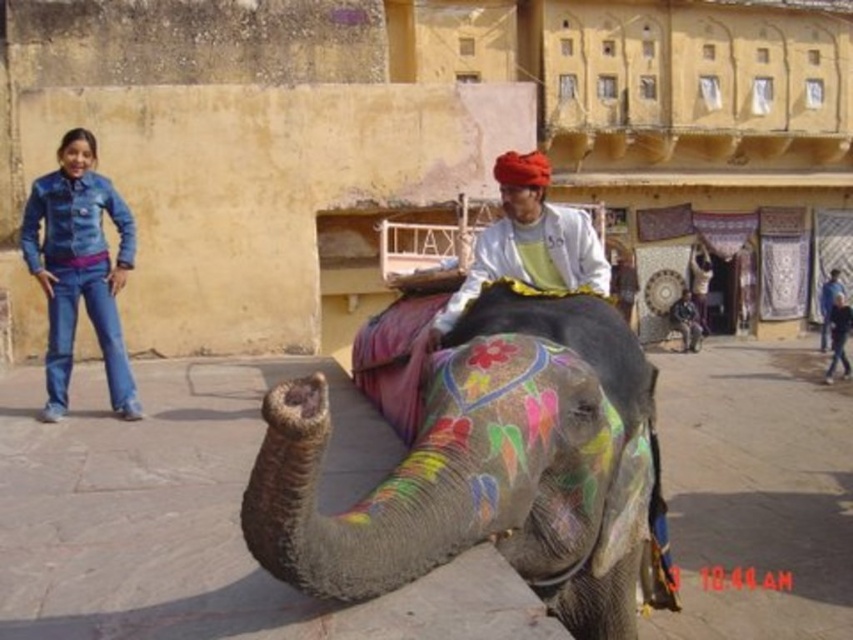
Question: Does painted fabric elephant at center appear over denim jeans at left?

Choices:
 (A) no
 (B) yes

Answer: (A)

Question: Which point appears closest to the camera in this image?

Choices:
 (A) (74, 246)
 (B) (502, 529)
 (C) (552, 275)

Answer: (B)

Question: Is denim jeans at left further to the viewer compared to matte white shirt at center?

Choices:
 (A) no
 (B) yes

Answer: (B)

Question: Estimate the real-world distances between objects in this image. Which object is closer to the painted fabric elephant at center?

Choices:
 (A) denim jeans at left
 (B) matte white shirt at center

Answer: (B)

Question: Which object appears farthest from the camera in this image?

Choices:
 (A) painted fabric elephant at center
 (B) denim jeans at left
 (C) matte white shirt at center

Answer: (B)

Question: Is painted fabric elephant at center thinner than denim jeans at left?

Choices:
 (A) yes
 (B) no

Answer: (B)